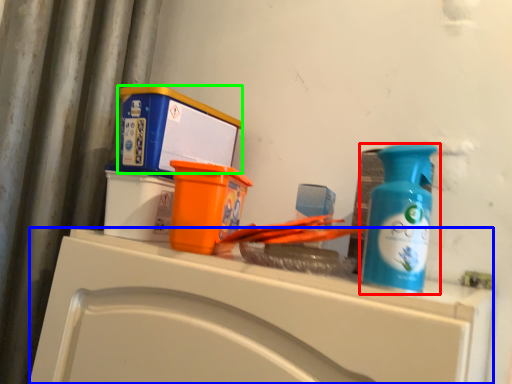
Question: Based on their relative distances, which object is nearer to bottle (highlighted by a red box)? Choose from counter (highlighted by a blue box) and box (highlighted by a green box).

Choices:
 (A) counter
 (B) box

Answer: (A)